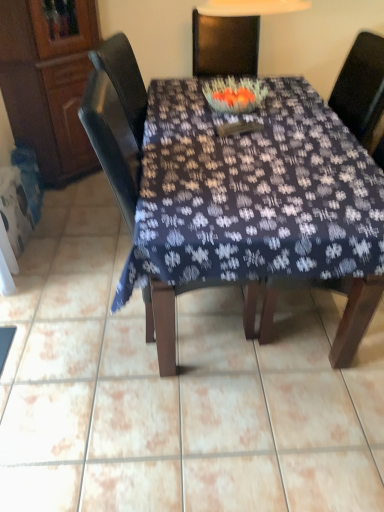
The width and height of the screenshot is (384, 512). Identify the location of free space to the left of matte dark wood chair at center, the first chair from the left. (71, 311).